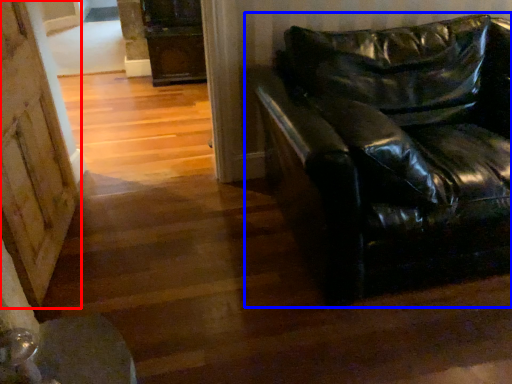
Question: Which point is further to the camera, barn door (highlighted by a red box) or studio couch (highlighted by a blue box)?

Choices:
 (A) barn door
 (B) studio couch

Answer: (A)